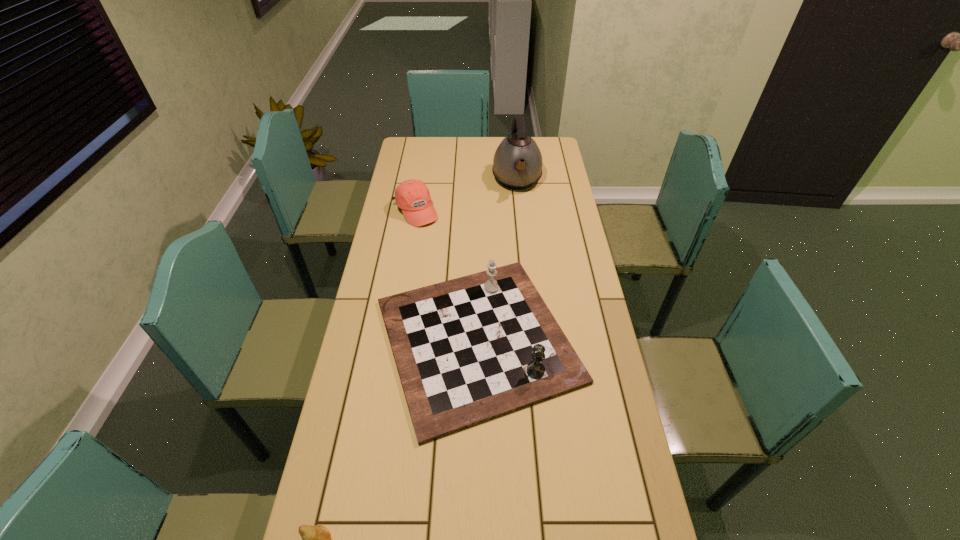
The image size is (960, 540). Identify the location of empty space between the tallest object and the second nearest object. (497, 260).

The width and height of the screenshot is (960, 540). In order to click on object that is the third closest to the gameboard in this screenshot , I will do 517,164.

Where is `object that is the nearest to the tallest object`? Image resolution: width=960 pixels, height=540 pixels. object that is the nearest to the tallest object is located at coordinates (412, 196).